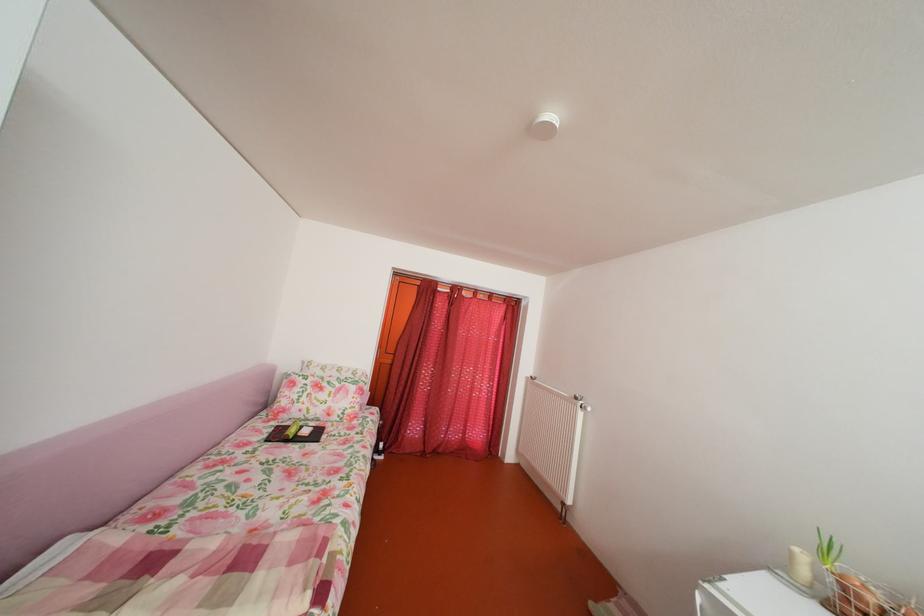
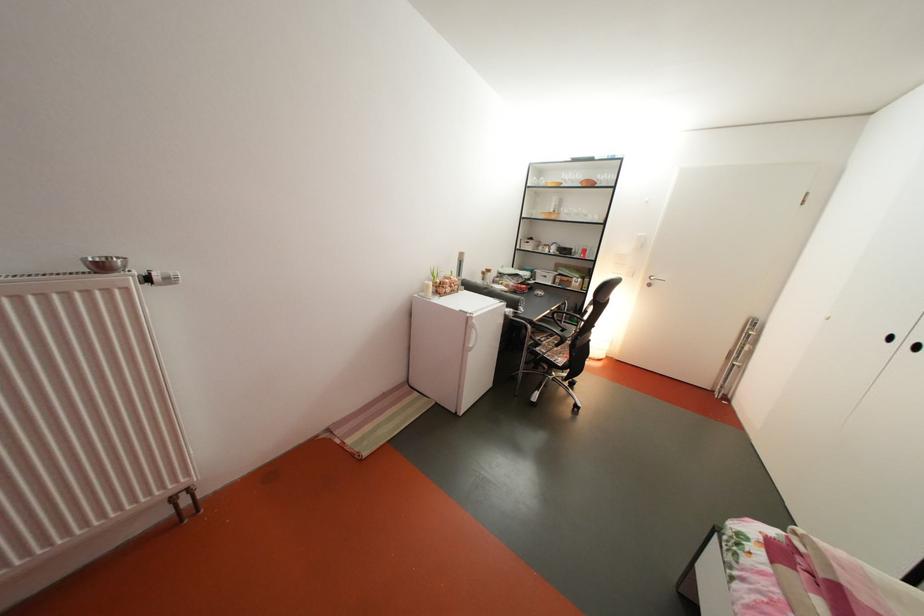
Locate, in the second image, the point that corresponds to point (803, 561) in the first image.

(439, 293)